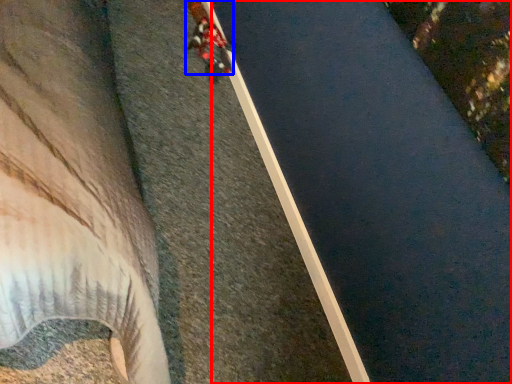
Question: Which point is further to the camera, waterway (highlighted by a red box) or person (highlighted by a blue box)?

Choices:
 (A) waterway
 (B) person

Answer: (B)